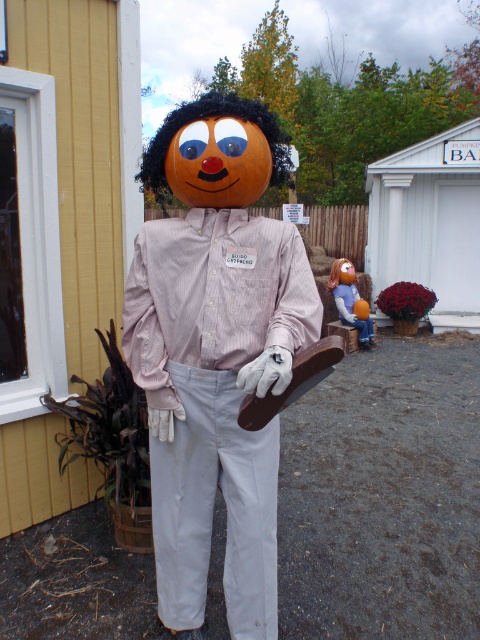
Question: Is pink striped shirt at center to the right of orange matte pumpkin at center from the viewer's perspective?

Choices:
 (A) yes
 (B) no

Answer: (B)

Question: Does pink striped shirt at center appear over orange matte pumpkin at center?

Choices:
 (A) no
 (B) yes

Answer: (A)

Question: Which object appears closest to the camera in this image?

Choices:
 (A) pink striped shirt at center
 (B) orange matte pumpkin at center

Answer: (A)

Question: Which object appears farthest from the camera in this image?

Choices:
 (A) orange matte pumpkin at center
 (B) pink striped shirt at center

Answer: (A)

Question: Is the position of pink striped shirt at center less distant than that of orange matte pumpkin at center?

Choices:
 (A) no
 (B) yes

Answer: (B)